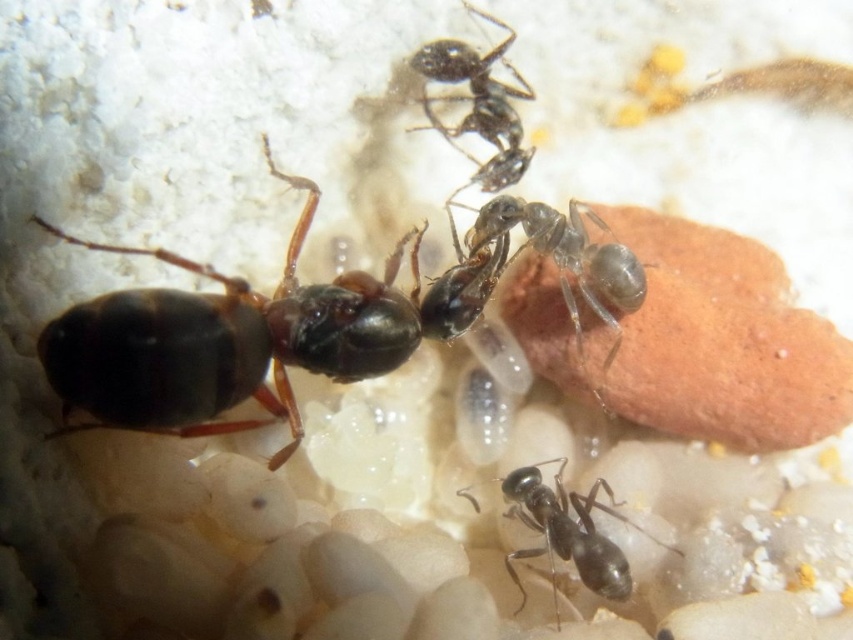
Question: Does shiny black ant at upper left appear on the right side of black glossy ant at upper center?

Choices:
 (A) no
 (B) yes

Answer: (A)

Question: Does black glossy ant at center appear over black glossy ant at upper center?

Choices:
 (A) no
 (B) yes

Answer: (A)

Question: Which of the following is the farthest from the observer?

Choices:
 (A) translucent gray ant at center
 (B) black glossy ant at center
 (C) black glossy ant at upper center

Answer: (C)

Question: Can you confirm if translucent gray ant at center is bigger than black glossy ant at center?

Choices:
 (A) yes
 (B) no

Answer: (A)

Question: Which object is closer to the camera taking this photo?

Choices:
 (A) shiny black ant at upper left
 (B) translucent gray ant at center

Answer: (A)

Question: Considering the real-world distances, which object is farthest from the translucent gray ant at center?

Choices:
 (A) black glossy ant at upper center
 (B) black glossy ant at center

Answer: (B)